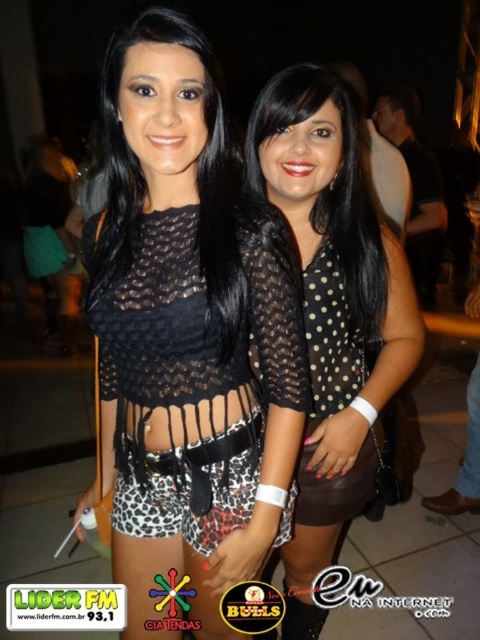
In the scene shown: You are a photographer at a party. You want to take a photo of the black dotted shirt at center and the black dotted sheer blouse at center. The camera you are using has a minimum focus distance of 3 inches. Will you be able to capture both subjects clearly in the same photo?

The distance between the black dotted shirt at center and the black dotted sheer blouse at center is 3.48 inches, which is greater than the camera minimum focus distance of 3 inches. Therefore, you can capture both subjects clearly in the same photo.

You are a photographer at a party and need to capture a clear shot of both the leopard print shorts at center and the black dotted sheer blouse at center. Given their height difference, which one should you focus on first to ensure both are in frame?

The leopard print shorts at center is much taller than the black dotted sheer blouse at center, so you should focus on the leopard print shorts at center first to ensure both are in frame.